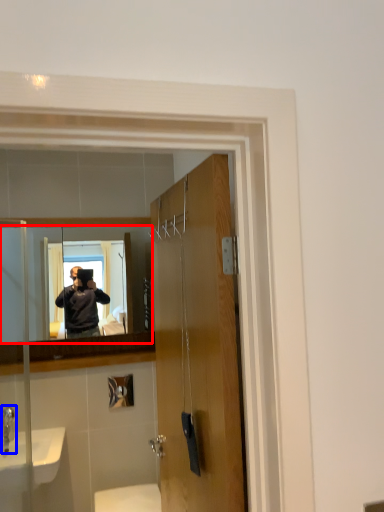
Question: Which object appears closest to the camera in this image, mirror (highlighted by a red box) or faucet (highlighted by a blue box)?

Choices:
 (A) mirror
 (B) faucet

Answer: (B)